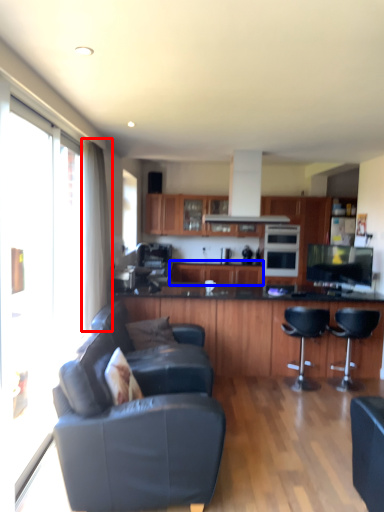
Question: Among these objects, which one is nearest to the camera, curtain (highlighted by a red box) or cabinetry (highlighted by a blue box)?

Choices:
 (A) curtain
 (B) cabinetry

Answer: (A)